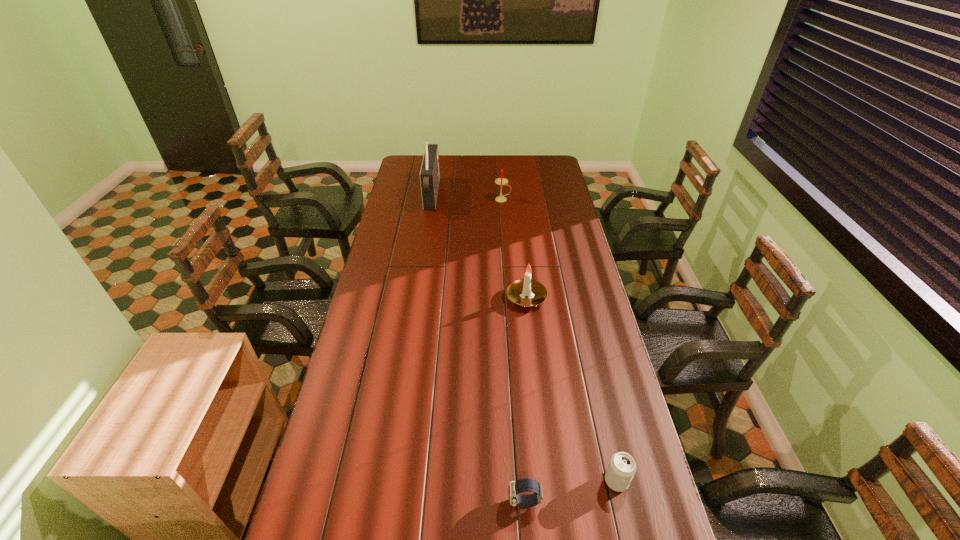
The width and height of the screenshot is (960, 540). Identify the location of free point between the farther candle and the rightmost object. (560, 340).

Where is `unoccupied area between the leftmost object and the nearer candle`? This screenshot has height=540, width=960. unoccupied area between the leftmost object and the nearer candle is located at coordinates (479, 246).

I want to click on free space between the farther candle and the can, so click(x=560, y=340).

Find the location of a particular element. vacant space that's between the tallest object and the third nearest object is located at coordinates (479, 246).

The width and height of the screenshot is (960, 540). Find the location of `vacant space that is in between the farther candle and the watch`. vacant space that is in between the farther candle and the watch is located at coordinates (514, 351).

This screenshot has width=960, height=540. I want to click on free area in between the nearer candle and the can, so (571, 389).

Where is `empty location between the farther candle and the watch`? The image size is (960, 540). empty location between the farther candle and the watch is located at coordinates (514, 351).

Identify which object is the nearest to the can. Please provide its 2D coordinates. Your answer should be formatted as a tuple, i.e. [(x, y)], where the tuple contains the x and y coordinates of a point satisfying the conditions above.

[(523, 485)]

Locate an element on the screen. object that is the second closest to the farther candle is located at coordinates (516, 291).

Locate an element on the screen. vacant area in the image that satisfies the following two spatial constraints: 1. on the front side of the farther candle; 2. on the left side of the can is located at coordinates (523, 481).